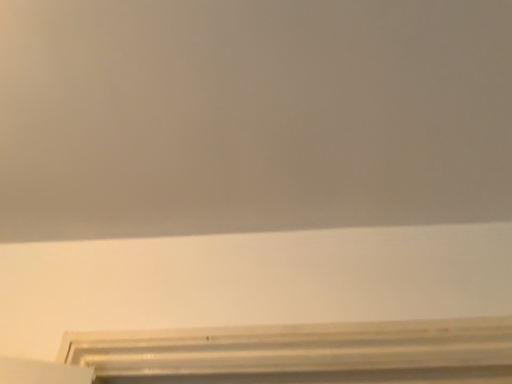
What do you see at coordinates (251, 116) in the screenshot? I see `matte white wall at upper center` at bounding box center [251, 116].

Identify the location of matte white wall at upper center. (251, 116).

Locate an element on the screen. The width and height of the screenshot is (512, 384). matte white wall at upper center is located at coordinates (251, 116).